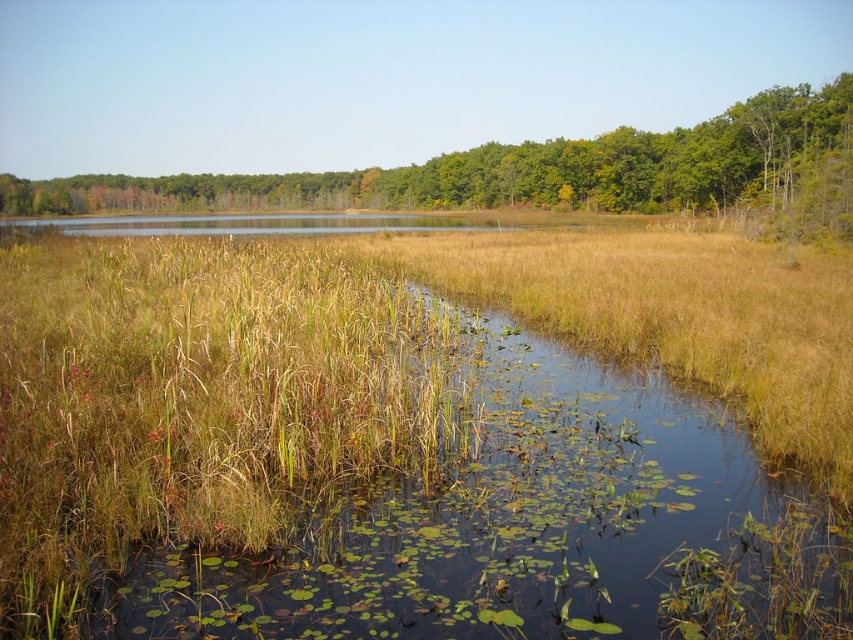
Question: Does green grass at center lie in front of green leafy trees at upper center?

Choices:
 (A) yes
 (B) no

Answer: (A)

Question: Which object is closer to the camera taking this photo?

Choices:
 (A) green leafy trees at upper center
 (B) green grass at center

Answer: (B)

Question: Which point is farther to the camera?

Choices:
 (A) green leafy trees at upper center
 (B) green grass at center

Answer: (A)

Question: Is green grass at center positioned before green leafy trees at upper center?

Choices:
 (A) yes
 (B) no

Answer: (A)

Question: Can you confirm if green grass at center is positioned below green leafy trees at upper center?

Choices:
 (A) yes
 (B) no

Answer: (A)